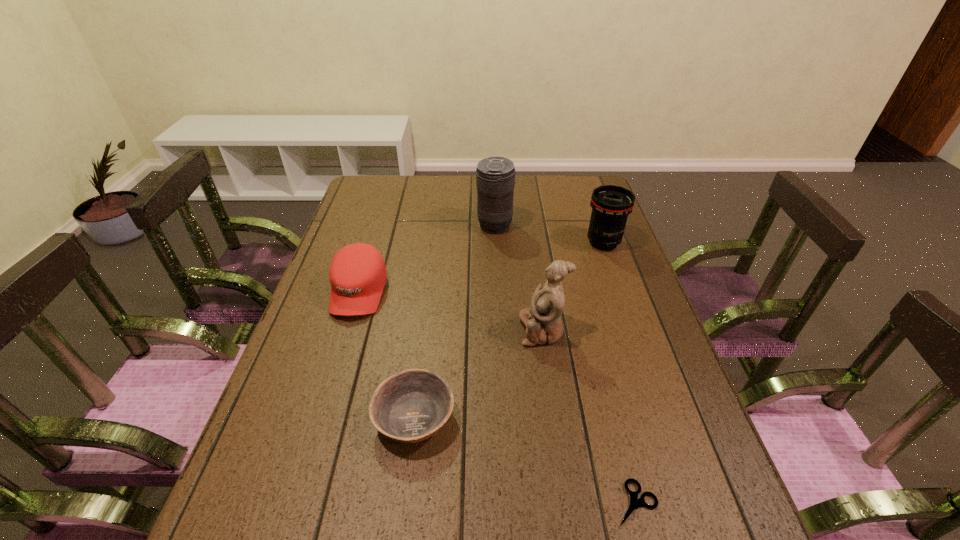
Find the location of a particular element. The image size is (960, 540). the left telephoto lens is located at coordinates (495, 176).

What are the coordinates of `figurine` in the screenshot? It's located at (542, 320).

Locate an element on the screen. The height and width of the screenshot is (540, 960). the rightmost object is located at coordinates (611, 205).

The image size is (960, 540). I want to click on the shorter telephoto lens, so click(611, 205).

Find the location of a particular element. Image resolution: width=960 pixels, height=540 pixels. the leftmost object is located at coordinates (357, 274).

You are a GUI agent. You are given a task and a screenshot of the screen. Output one action in this format:
    pyautogui.click(x=<x>, y=<y>)
    Task: Click on the third shortest object
    
    Given the screenshot: What is the action you would take?
    pyautogui.click(x=357, y=274)

This screenshot has width=960, height=540. Find the location of `bowl`. bowl is located at coordinates (411, 406).

This screenshot has width=960, height=540. I want to click on the second nearest object, so click(x=411, y=406).

Where is `the second object from right to left`? the second object from right to left is located at coordinates (635, 503).

Locate an element on the screen. This screenshot has width=960, height=540. the shortest object is located at coordinates coord(635,503).